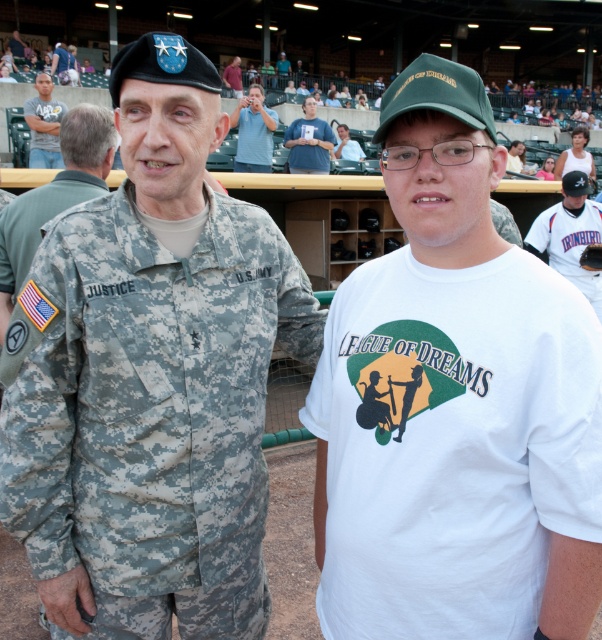
Question: Estimate the real-world distances between objects in this image. Which object is farther from the matte black beret at upper center?

Choices:
 (A) white jersey at right
 (B) blue t-shirt at center
 (C) matte gray t-shirt at upper left
 (D) camouflage uniform at center

Answer: (D)

Question: Among these objects, which one is nearest to the camera?

Choices:
 (A) white jersey at right
 (B) white cotton t-shirt at center
 (C) matte black beret at upper center

Answer: (B)

Question: Which object appears closest to the camera in this image?

Choices:
 (A) camouflage uniform at center
 (B) matte gray t-shirt at upper left
 (C) light blue shirt at center

Answer: (A)

Question: Does white jersey at right lie in front of matte gray t-shirt at upper left?

Choices:
 (A) no
 (B) yes

Answer: (B)

Question: Does blue t-shirt at center appear on the right side of matte black beret at upper center?

Choices:
 (A) no
 (B) yes

Answer: (B)

Question: In this image, where is camouflage uniform at center located relative to matte black beret at upper center?

Choices:
 (A) above
 (B) below

Answer: (B)